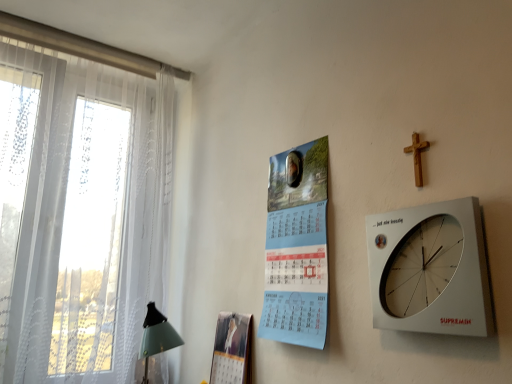
Question: Considering the positions of point (412, 135) and point (219, 339), is point (412, 135) closer or farther from the camera than point (219, 339)?

Choices:
 (A) farther
 (B) closer

Answer: (B)

Question: Would you say wooden cross at upper right is to the left or to the right of matte paper magazine at center in the picture?

Choices:
 (A) right
 (B) left

Answer: (A)

Question: Which is nearer to the white sheer curtain at left?

Choices:
 (A) light blue paper calendar at center
 (B) white plastic wall clock at upper right
 (C) wooden cross at upper right
 (D) matte paper magazine at center

Answer: (D)

Question: Which is farther from the light blue paper calendar at center?

Choices:
 (A) white plastic wall clock at upper right
 (B) white sheer curtain at left
 (C) matte paper magazine at center
 (D) wooden cross at upper right

Answer: (B)